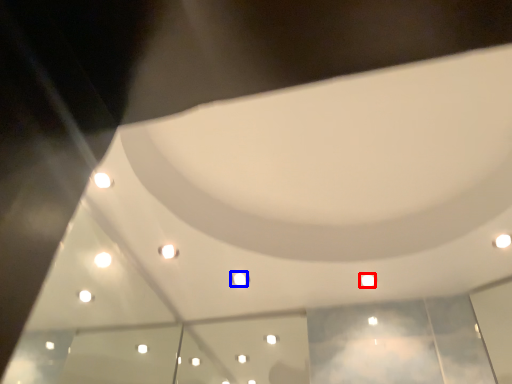
Question: Which point is further to the camera, light (highlighted by a red box) or light (highlighted by a blue box)?

Choices:
 (A) light
 (B) light

Answer: (B)